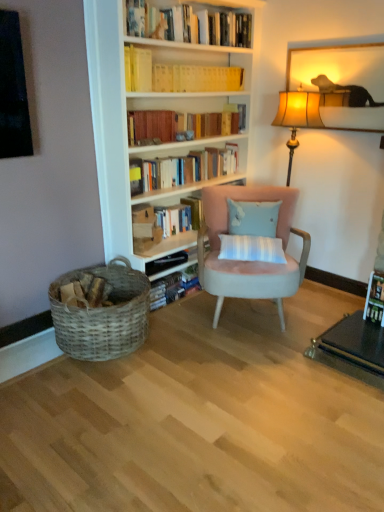
Question: Considering the positions of yellow paperbacks at upper center, which is the 1th book in top-to-bottom order, and wooden picture frame at upper right in the image, is yellow paperbacks at upper center, which is the 1th book in top-to-bottom order, bigger or smaller than wooden picture frame at upper right?

Choices:
 (A) big
 (B) small

Answer: (A)

Question: Choose the correct answer: Is yellow paperbacks at upper center, which is the 5th book from bottom to top, inside wooden picture frame at upper right or outside it?

Choices:
 (A) inside
 (B) outside

Answer: (B)

Question: Which of these objects is positioned farthest from the light blue fabric pillow at center?

Choices:
 (A) yellow paperbacks at upper center, which is the 1th book in top-to-bottom order
 (B) hardcover books at center, which is counted as the first book, starting from the bottom
 (C) hardcover books at upper center, placed as the 4th book when sorted from top to bottom
 (D) hardcover book at upper center, which is counted as the third book, starting from the bottom
 (E) suede pink armchair at center

Answer: (A)

Question: Which of these objects is positioned closest to the yellow paper at upper center, marked as the second book in a top-to-bottom arrangement?

Choices:
 (A) woven wood basket at lower left
 (B) yellow paperbacks at upper center, which is the 1th book in top-to-bottom order
 (C) suede pink armchair at center
 (D) hardcover books at center, which is counted as the 5th book, starting from the top
 (E) hardcover books at upper center, the 2th book in the bottom-to-top sequence

Answer: (B)